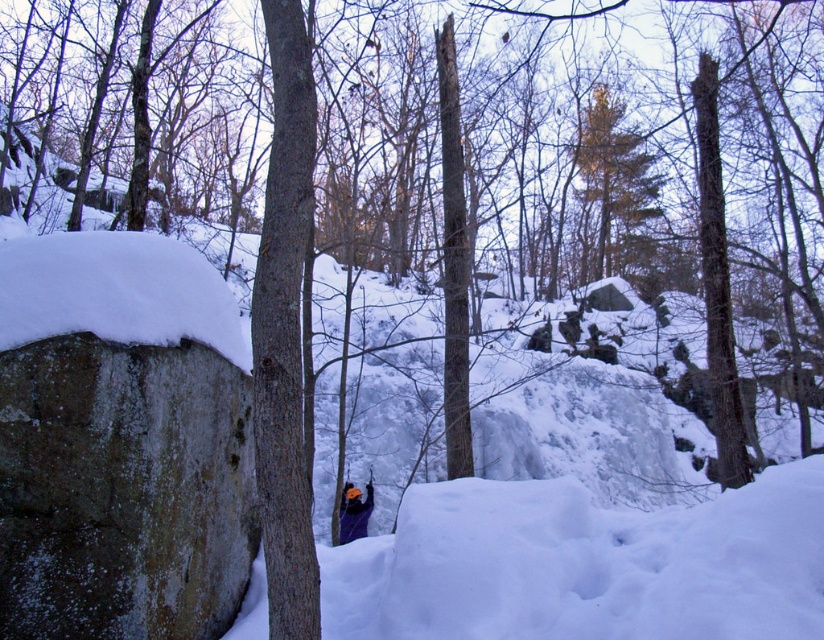
Who is taller, speckled stone boulder at left or brown textured tree at upper center?

brown textured tree at upper center

Is speckled stone boulder at left taller than brown textured tree at upper center?

Incorrect, speckled stone boulder at left's height is not larger of brown textured tree at upper center's.

You are a GUI agent. You are given a task and a screenshot of the screen. Output one action in this format:
    pyautogui.click(x=<x>, y=<y>)
    Task: Click on the speckled stone boulder at left
    
    Given the screenshot: What is the action you would take?
    pyautogui.click(x=123, y=490)

I want to click on speckled stone boulder at left, so click(123, 490).

Is speckled stone boulder at left shorter than orange helmet at center?

No.

Who is positioned more to the left, speckled stone boulder at left or orange helmet at center?

speckled stone boulder at left is more to the left.

Is point (96, 627) positioned in front of point (368, 509)?

Yes, it is.

Locate an element on the screen. speckled stone boulder at left is located at coordinates (123, 490).

Describe the element at coordinates (611, 189) in the screenshot. I see `brown textured tree at upper center` at that location.

Locate an element on the screen. This screenshot has width=824, height=640. brown textured tree at upper center is located at coordinates (611, 189).